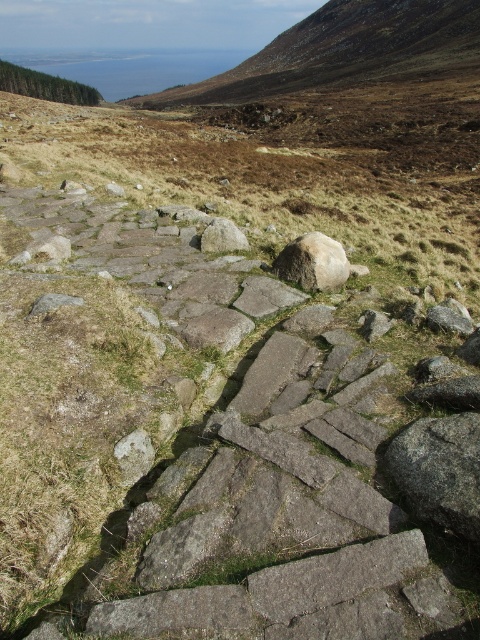
Question: In this image, where is brown rough stone at upper center located relative to gray rough rock at center?

Choices:
 (A) below
 (B) above

Answer: (B)

Question: Is brown rough stone at upper center thinner than white smooth rock at center?

Choices:
 (A) yes
 (B) no

Answer: (B)

Question: Which point appears farthest from the camera in this image?

Choices:
 (A) (344, 264)
 (B) (368, 22)
 (C) (235, 225)

Answer: (B)

Question: Among these objects, which one is farthest from the camera?

Choices:
 (A) white smooth rock at center
 (B) gray rough rock at center

Answer: (B)

Question: Which point is closer to the camera taking this photo?

Choices:
 (A) (346, 275)
 (B) (217, 244)
 (C) (417, 20)

Answer: (A)

Question: Can you confirm if brown rough stone at upper center is positioned to the left of gray rough rock at center?

Choices:
 (A) yes
 (B) no

Answer: (B)